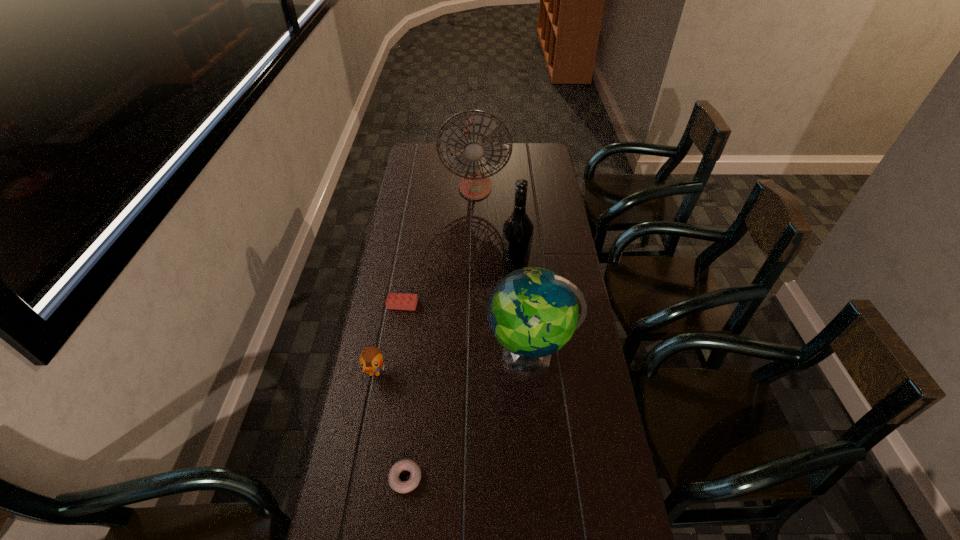
The width and height of the screenshot is (960, 540). What are the coordinates of `fan` in the screenshot? It's located at (474, 185).

The height and width of the screenshot is (540, 960). Find the location of `wine bottle`. wine bottle is located at coordinates (518, 229).

The image size is (960, 540). What are the coordinates of `globe` in the screenshot? It's located at (533, 312).

The height and width of the screenshot is (540, 960). I want to click on duck, so click(x=371, y=359).

Image resolution: width=960 pixels, height=540 pixels. What are the coordinates of `the third farthest object` in the screenshot? It's located at (400, 301).

Where is `Lego`? The image size is (960, 540). Lego is located at coordinates (400, 301).

Locate an element on the screen. The image size is (960, 540). the nearest object is located at coordinates (396, 484).

You are a GUI agent. You are given a task and a screenshot of the screen. Output one action in this format:
    pyautogui.click(x=<x>, y=<y>)
    Task: Click on the doughnut
    This screenshot has height=540, width=960.
    Given the screenshot: What is the action you would take?
    pyautogui.click(x=396, y=484)

The width and height of the screenshot is (960, 540). Find the location of `vacant space located in front of the farthest object to direct airflow`. vacant space located in front of the farthest object to direct airflow is located at coordinates (474, 244).

What are the coordinates of `free region located 0.180m on the label of the second farthest object` in the screenshot? It's located at (455, 266).